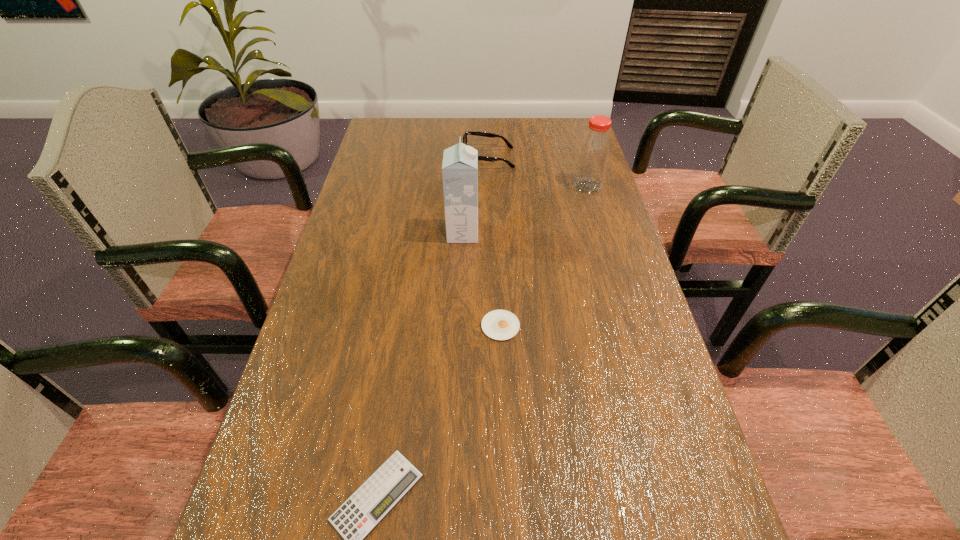
Where is `vacant region at the far right corner of the desktop`? vacant region at the far right corner of the desktop is located at coordinates (570, 130).

This screenshot has width=960, height=540. I want to click on vacant space that is in between the spectacles and the second shortest object, so click(x=494, y=242).

Find the location of a particular element. This screenshot has height=540, width=960. empty location between the farthest object and the fourth tallest object is located at coordinates (494, 242).

Identify which object is the fourth nearest to the spectacles. Please provide its 2D coordinates. Your answer should be formatted as a tuple, i.e. [(x, y)], where the tuple contains the x and y coordinates of a point satisfying the conditions above.

[(360, 514)]

Point out which object is positioned as the fourth nearest to the bottle. Please provide its 2D coordinates. Your answer should be formatted as a tuple, i.e. [(x, y)], where the tuple contains the x and y coordinates of a point satisfying the conditions above.

[(360, 514)]

Identify the location of blank space that satisfies the following two spatial constraints: 1. on the lenses of the farthest object; 2. on the right side of the fourth shortest object. The width and height of the screenshot is (960, 540). (490, 186).

Where is `free location that satisfies the following two spatial constraints: 1. on the lenses of the third tallest object; 2. on the right side of the fourth farthest object`? This screenshot has width=960, height=540. free location that satisfies the following two spatial constraints: 1. on the lenses of the third tallest object; 2. on the right side of the fourth farthest object is located at coordinates (492, 326).

What are the coordinates of `free point that satisfies the following two spatial constraints: 1. on the lenses of the spectacles; 2. on the back side of the fourth tallest object` in the screenshot? It's located at (492, 326).

Find the location of a particular element. vacant point that satisfies the following two spatial constraints: 1. on the lenses of the third tallest object; 2. on the right side of the bottle is located at coordinates (490, 186).

Where is `vacant region that satisfies the following two spatial constraints: 1. on the lenses of the fourth tallest object; 2. on the left side of the third shortest object`? The width and height of the screenshot is (960, 540). vacant region that satisfies the following two spatial constraints: 1. on the lenses of the fourth tallest object; 2. on the left side of the third shortest object is located at coordinates (492, 326).